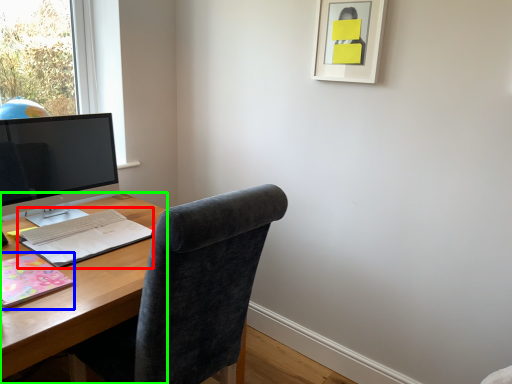
Question: Based on their relative distances, which object is farther from notebook (highlighted by a red box)? Choose from notebook (highlighted by a blue box) and desk (highlighted by a green box).

Choices:
 (A) notebook
 (B) desk

Answer: (A)